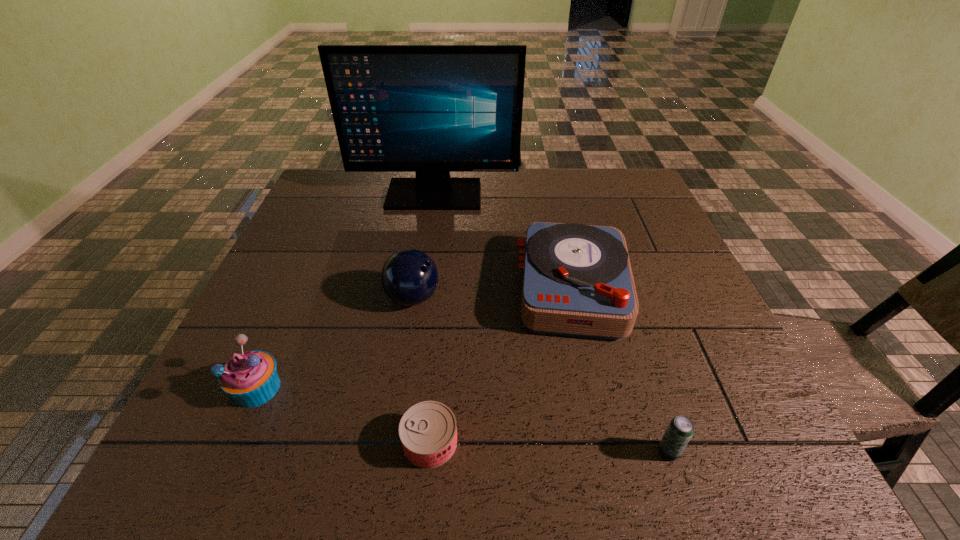
At what (x,y) coordinates should I click in order to perform the action: click on the farthest object. Please return your answer as a coordinate pair (x, y). The height and width of the screenshot is (540, 960). Looking at the image, I should click on (430, 109).

The width and height of the screenshot is (960, 540). What are the coordinates of `monitor` in the screenshot? It's located at (430, 109).

You are a GUI agent. You are given a task and a screenshot of the screen. Output one action in this format:
    pyautogui.click(x=<x>, y=<y>)
    Task: Click on the bowling ball
    This screenshot has width=960, height=540.
    Given the screenshot: What is the action you would take?
    pyautogui.click(x=409, y=277)

Where is `record player`? This screenshot has height=540, width=960. record player is located at coordinates (577, 279).

This screenshot has width=960, height=540. I want to click on the fourth farthest object, so click(x=250, y=378).

Image resolution: width=960 pixels, height=540 pixels. Find the location of `the second shortest object`. the second shortest object is located at coordinates (680, 430).

Where is `the shortest object`? the shortest object is located at coordinates (428, 430).

In order to click on free location located on the screen side of the farthest object in this screenshot , I will do `click(430, 222)`.

At what (x,y) coordinates should I click in order to perform the action: click on free space located 0.290m on the surface of the bowling ball near the finger holes. Please return your answer as a coordinate pair (x, y). The image size is (960, 540). Looking at the image, I should click on (564, 298).

This screenshot has height=540, width=960. Identify the location of vacant region located on the back of the record player. (558, 219).